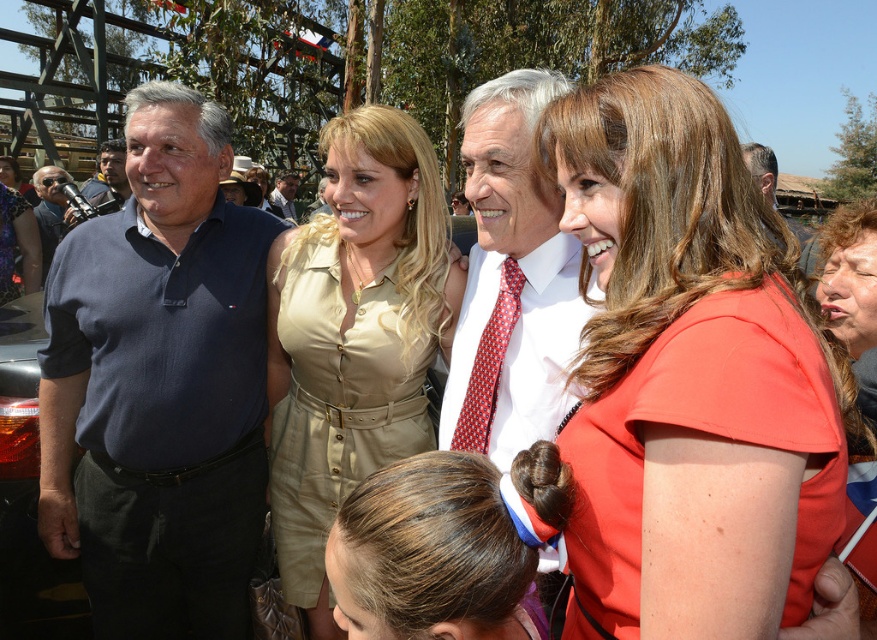
You are taking a photo of two points in the image. The first point is at coordinate point [59,513] and the second is at point [279,202]. Which point will appear larger in your photo?

Point [59,513] is closer to the camera than point [279,202], so it will appear larger in the photo.

You are a photographer at the event and want to take a group photo of the matte blue shirt at left and the matte khaki shirt at center. Which person should stand in the back to ensure both are fully visible?

The matte khaki shirt at center should stand in the back because the matte blue shirt at left is shorter than the matte khaki shirt at center, so placing the taller matte khaki shirt at center at the back would allow the shorter matte blue shirt at left to be visible in front.

You are a photographer at a social event and need to capture a photo of both the orange matte dress at right and the beige fabric dress at center. Which dress is located to the right of the other?

The orange matte dress at right is positioned on the right side of the beige fabric dress at center.